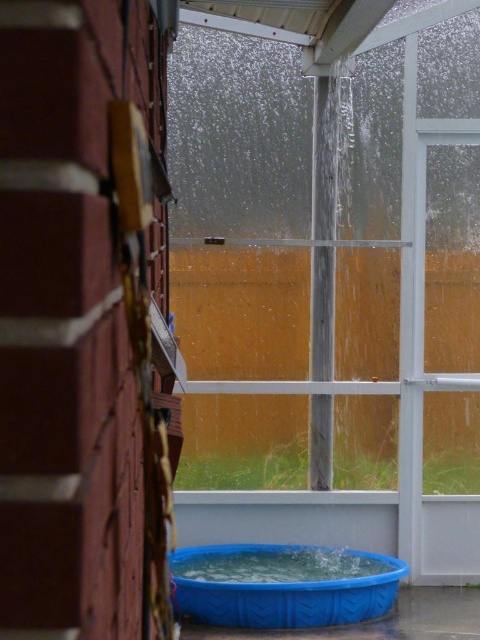
Between point (196, 28) and point (179, 564), which one is positioned in front?

Point (179, 564)

Does transparent plastic window at center have a lesser width compared to blue plastic pool at lower center?

Incorrect, transparent plastic window at center's width is not less than blue plastic pool at lower center's.

Describe the element at coordinates (327, 252) in the screenshot. I see `transparent plastic window at center` at that location.

I want to click on transparent plastic window at center, so click(x=327, y=252).